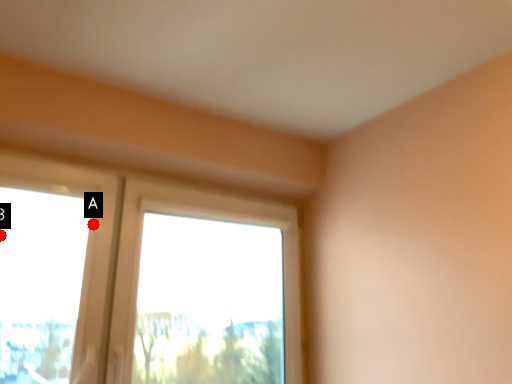
Question: Two points are circled on the image, labeled by A and B beside each circle. Which of the following is the closest to the observer?

Choices:
 (A) A is closer
 (B) B is closer

Answer: (B)